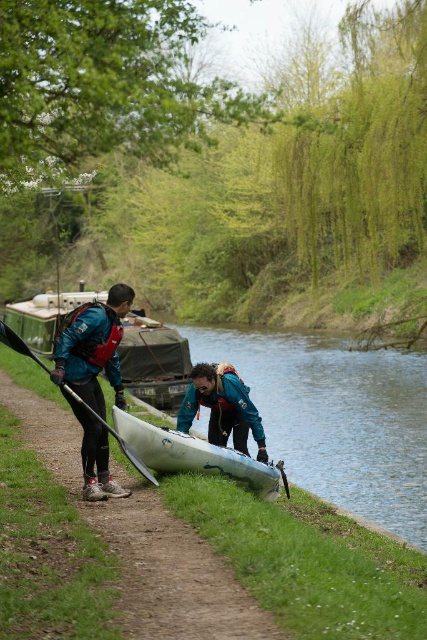
You are a hiker who wants to take a photo of the matte blue jacket at left and the matte black paddle at left. Since you want both items in the frame, which direction should you move to ensure both are visible? Please mention both objects in your answer.

The matte blue jacket at left is to the left of the matte black paddle at left. To include both in your photo, move to the right side so that both the matte blue jacket at left and the matte black paddle at left are within the frame.

You are standing on the dirt path near the river and need to decide whether to place a small backpack between the matte blue jacket at left and the matte black paddle at left. Since the backpack is 1.2 meters wide, will it fit between them?

The matte blue jacket at left is wider than the matte black paddle at left. However, the exact distance between them isn not specified in the objects description. Therefore, it is uncertain if the backpack will fit.

You are planning to store the matte green boat at center and the white plastic canoe at lower center in a garage with a 2.5 meter height limit. Based on their heights, will both fit vertically without needing to be disassembled?

The matte green boat at center is taller than the white plastic canoe at lower center. Since the height limit is 2.5 meters, but we don not have exact measurements, it is uncertain if they will fit. Please check the exact height of the taller boat first.